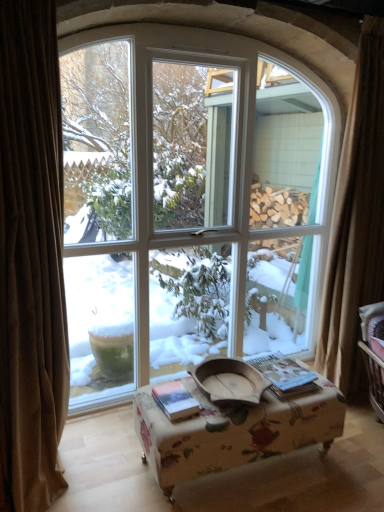
Find the location of a particular element. The height and width of the screenshot is (512, 384). vacant area that lies to the right of brown velvet curtain at left, marked as the second curtain in a back-to-front arrangement is located at coordinates (112, 476).